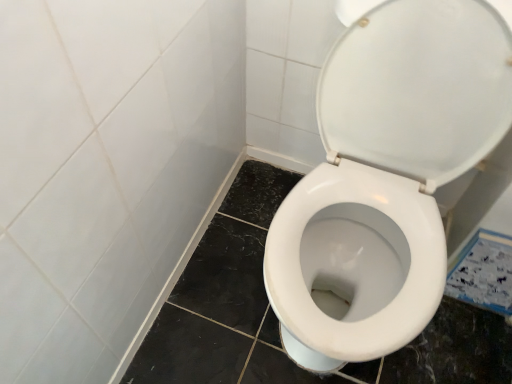
Question: Is white glossy toilet at center spatially inside white glossy ceramic tile at lower right, or outside of it?

Choices:
 (A) inside
 (B) outside

Answer: (B)

Question: Does point (415, 218) appear closer or farther from the camera than point (480, 289)?

Choices:
 (A) farther
 (B) closer

Answer: (B)

Question: In terms of size, does white glossy toilet at center appear bigger or smaller than white glossy ceramic tile at lower right?

Choices:
 (A) big
 (B) small

Answer: (A)

Question: From the image's perspective, is white glossy ceramic tile at lower right above or below white glossy toilet at center?

Choices:
 (A) below
 (B) above

Answer: (A)

Question: Considering the positions of point (476, 271) and point (477, 34), is point (476, 271) closer or farther from the camera than point (477, 34)?

Choices:
 (A) closer
 (B) farther

Answer: (B)

Question: Is white glossy ceramic tile at lower right in front of or behind white glossy toilet at center in the image?

Choices:
 (A) behind
 (B) front

Answer: (A)

Question: Considering the relative positions of white glossy ceramic tile at lower right and white glossy toilet at center in the image provided, is white glossy ceramic tile at lower right to the left or to the right of white glossy toilet at center?

Choices:
 (A) right
 (B) left

Answer: (A)